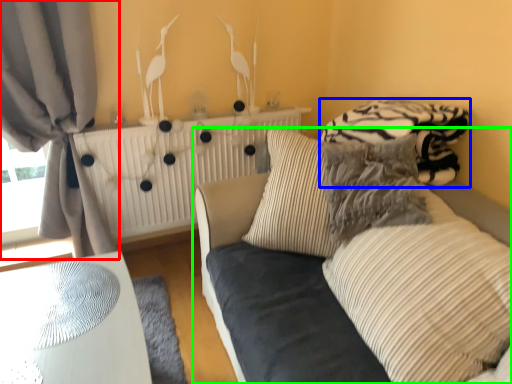
Question: Estimate the real-world distances between objects in this image. Which object is closer to curtain (highlighted by a red box), bedding (highlighted by a blue box) or studio couch (highlighted by a green box)?

Choices:
 (A) bedding
 (B) studio couch

Answer: (B)